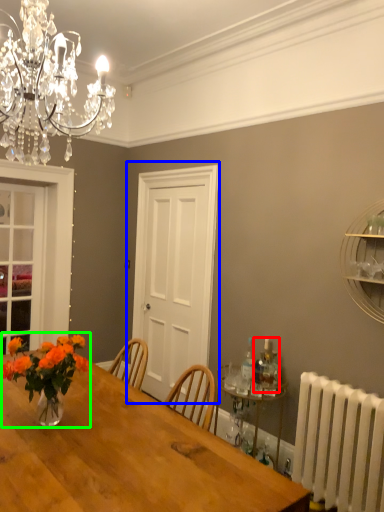
Question: Estimate the real-world distances between objects in this image. Which object is closer to bottle (highlighted by a red box), door (highlighted by a blue box) or floral arrangement (highlighted by a green box)?

Choices:
 (A) door
 (B) floral arrangement

Answer: (B)